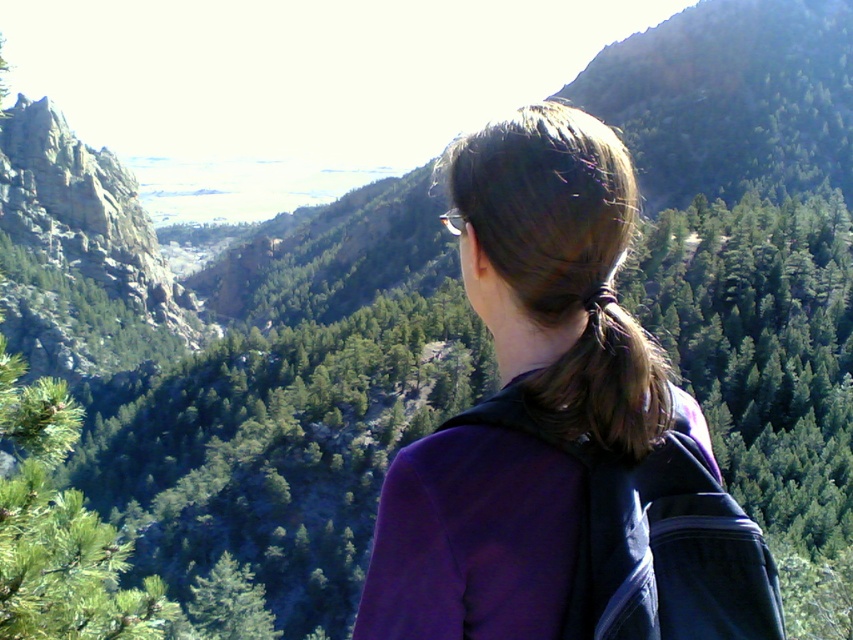
Who is higher up, purple fabric at center or brown shiny hair at center?

brown shiny hair at center

Does purple fabric at center appear on the right side of brown shiny hair at center?

In fact, purple fabric at center is to the left of brown shiny hair at center.

Who is more forward, (585, 612) or (613, 371)?

A: Positioned in front is point (585, 612).

Find the location of a particular element. Image resolution: width=853 pixels, height=640 pixels. purple fabric at center is located at coordinates (560, 432).